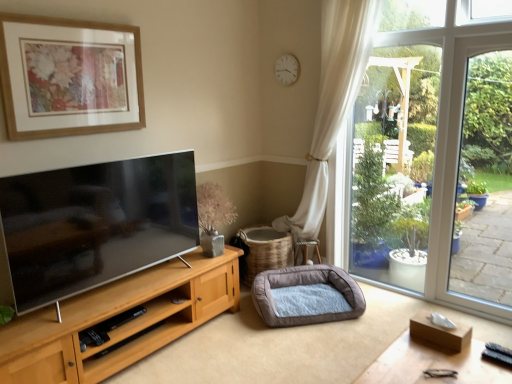
Question: Considering the positions of beige woven basket at center and soft gray fabric dog bed at lower center in the image, is beige woven basket at center bigger or smaller than soft gray fabric dog bed at lower center?

Choices:
 (A) small
 (B) big

Answer: (B)

Question: Is beige woven basket at center spatially inside soft gray fabric dog bed at lower center, or outside of it?

Choices:
 (A) inside
 (B) outside

Answer: (B)

Question: Estimate the real-world distances between objects in this image. Which object is farther from the white plastic clock at upper center?

Choices:
 (A) wooden table at lower right
 (B) soft gray fabric dog bed at lower center
 (C) beige woven basket at center
 (D) wooden picture frame at upper left

Answer: (A)

Question: Estimate the real-world distances between objects in this image. Which object is farther from the beige woven basket at center?

Choices:
 (A) soft gray fabric dog bed at lower center
 (B) wooden table at lower right
 (C) white plastic clock at upper center
 (D) wooden picture frame at upper left

Answer: (B)